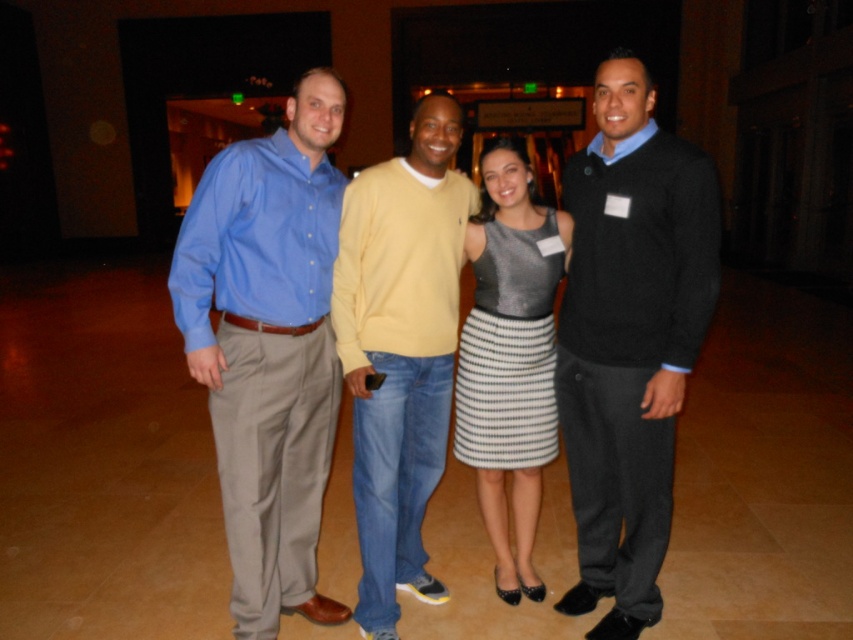
Between matte black sweater at right and shiny metallic dress at center, which one is positioned higher?

shiny metallic dress at center

Locate an element on the screen. matte black sweater at right is located at coordinates (630, 339).

Find the location of a particular element. matte black sweater at right is located at coordinates (630, 339).

Who is taller, matte blue shirt at left or matte black sweater at right?

With more height is matte black sweater at right.

Is matte blue shirt at left above matte black sweater at right?

Incorrect, matte blue shirt at left is not positioned above matte black sweater at right.

Does point (198, 273) lie in front of point (645, 496)?

That is True.

This screenshot has height=640, width=853. I want to click on matte blue shirt at left, so click(x=268, y=348).

Is matte blue shirt at left to the left of shiny metallic dress at center from the viewer's perspective?

Yes, matte blue shirt at left is to the left of shiny metallic dress at center.

Who is more distant from viewer, (247, 278) or (523, 333)?

Point (523, 333)

Is point (322, 100) positioned before point (496, 448)?

Yes, point (322, 100) is in front of point (496, 448).

Where is `matte blue shirt at left`? This screenshot has height=640, width=853. matte blue shirt at left is located at coordinates (268, 348).